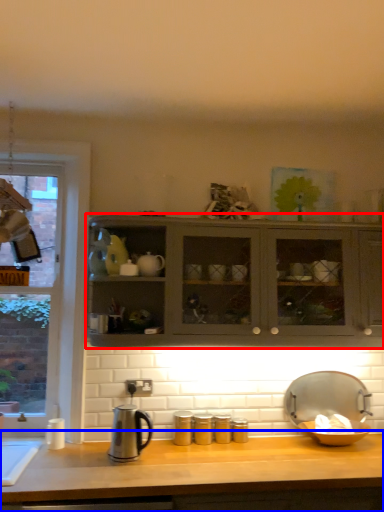
Question: Which object appears closest to the camera in this image, cabinetry (highlighted by a red box) or countertop (highlighted by a blue box)?

Choices:
 (A) cabinetry
 (B) countertop

Answer: (B)